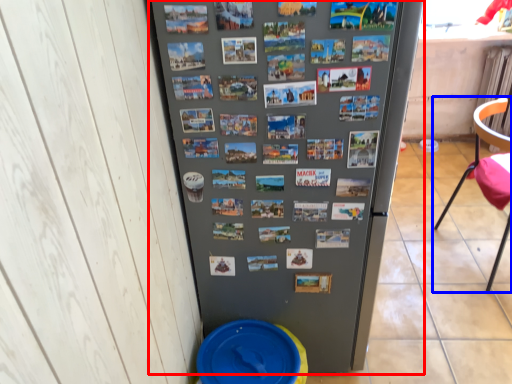
Question: Which object is closer to the camera taking this photo, refrigerator (highlighted by a red box) or chair (highlighted by a blue box)?

Choices:
 (A) refrigerator
 (B) chair

Answer: (A)